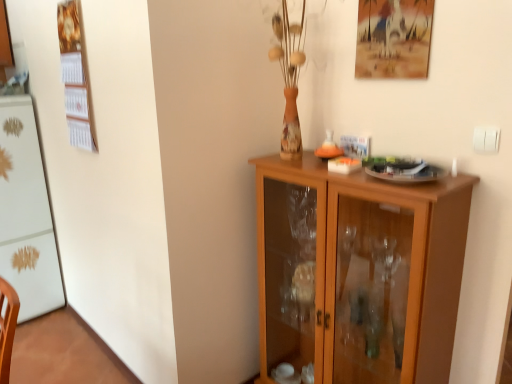
The width and height of the screenshot is (512, 384). Describe the element at coordinates (393, 38) in the screenshot. I see `matte wooden picture frame at upper right` at that location.

Find the location of `wooden cabinet at center`. wooden cabinet at center is located at coordinates (358, 272).

From the image's perspective, relative to wooden cabinet at center, is white glossy refrigerator at left above or below?

Based on their image positions, white glossy refrigerator at left is located above wooden cabinet at center.

Considering the sizes of objects white glossy refrigerator at left and wooden cabinet at center in the image provided, who is thinner, white glossy refrigerator at left or wooden cabinet at center?

Thinner between the two is wooden cabinet at center.

Looking at this image, considering the relative positions of white glossy refrigerator at left and wooden cabinet at center in the image provided, is white glossy refrigerator at left in front of wooden cabinet at center?

No, white glossy refrigerator at left is behind wooden cabinet at center.

Is white glossy refrigerator at left placed right next to wooden cabinet at center?

They are not placed beside each other.

Is matte wooden picture frame at upper right not close to wooden cabinet at center?

No, there isn't a large distance between matte wooden picture frame at upper right and wooden cabinet at center.

From the image's perspective, is matte wooden picture frame at upper right under wooden cabinet at center?

No.

How far apart are matte wooden picture frame at upper right and wooden cabinet at center?

A distance of 29.74 inches exists between matte wooden picture frame at upper right and wooden cabinet at center.

Is wooden cabinet at center at the back of matte wooden picture frame at upper right?

That's not correct — matte wooden picture frame at upper right is not looking away from wooden cabinet at center.

Is wooden cabinet at center placed right next to white glossy refrigerator at left?

They are not placed beside each other.

Consider the image. From a real-world perspective, which is physically below, wooden cabinet at center or white glossy refrigerator at left?

wooden cabinet at center.

At what (x,y) coordinates should I click in order to perform the action: click on appliance above the wooden cabinet at center (from the image's perspective). Please return your answer as a coordinate pair (x, y). The height and width of the screenshot is (384, 512). Looking at the image, I should click on (26, 213).

From the image's perspective, which one is positioned higher, wooden cabinet at center or white glossy refrigerator at left?

white glossy refrigerator at left.

From the image's perspective, which is above, white glossy refrigerator at left or matte wooden picture frame at upper right?

matte wooden picture frame at upper right.

Is white glossy refrigerator at left behind matte wooden picture frame at upper right?

Yes.

Consider the image. How much distance is there between white glossy refrigerator at left and matte wooden picture frame at upper right?

white glossy refrigerator at left is 7.24 feet away from matte wooden picture frame at upper right.

Image resolution: width=512 pixels, height=384 pixels. I want to click on appliance behind the matte wooden picture frame at upper right, so [26, 213].

In the image, is wooden cabinet at center on the left side or the right side of matte wooden picture frame at upper right?

wooden cabinet at center is positioned on matte wooden picture frame at upper right's left side.

Which of these two, wooden cabinet at center or matte wooden picture frame at upper right, is smaller?

matte wooden picture frame at upper right.

Is wooden cabinet at center facing towards matte wooden picture frame at upper right?

No.

Considering the points (380, 33) and (20, 173), which point is in front, point (380, 33) or point (20, 173)?

Positioned in front is point (380, 33).

Is matte wooden picture frame at upper right far from white glossy refrigerator at left?

matte wooden picture frame at upper right is far away from white glossy refrigerator at left.

From the image's perspective, is matte wooden picture frame at upper right above or below white glossy refrigerator at left?

Based on their image positions, matte wooden picture frame at upper right is located above white glossy refrigerator at left.

Can you confirm if matte wooden picture frame at upper right is shorter than white glossy refrigerator at left?

Yes, matte wooden picture frame at upper right is shorter than white glossy refrigerator at left.

Locate an element on the screen. This screenshot has width=512, height=384. cupboard located on the right of white glossy refrigerator at left is located at coordinates (358, 272).

At what (x,y) coordinates should I click in order to perform the action: click on cupboard below the matte wooden picture frame at upper right (from the image's perspective). Please return your answer as a coordinate pair (x, y). This screenshot has height=384, width=512. Looking at the image, I should click on coord(358,272).

Estimate the real-world distances between objects in this image. Which object is closer to wooden cabinet at center, white glossy refrigerator at left or matte wooden picture frame at upper right?

matte wooden picture frame at upper right.

From the image, which object appears to be nearer to matte wooden picture frame at upper right, white glossy refrigerator at left or wooden cabinet at center?

wooden cabinet at center lies closer to matte wooden picture frame at upper right than the other object.

From the image, which object appears to be nearer to wooden cabinet at center, matte wooden picture frame at upper right or white glossy refrigerator at left?

Based on the image, matte wooden picture frame at upper right appears to be nearer to wooden cabinet at center.

Consider the image. From the image, which object appears to be nearer to matte wooden picture frame at upper right, wooden cabinet at center or white glossy refrigerator at left?

Based on the image, wooden cabinet at center appears to be nearer to matte wooden picture frame at upper right.

Estimate the real-world distances between objects in this image. Which object is further from white glossy refrigerator at left, wooden cabinet at center or matte wooden picture frame at upper right?

A: Based on the image, matte wooden picture frame at upper right appears to be further to white glossy refrigerator at left.

Based on their spatial positions, is matte wooden picture frame at upper right or wooden cabinet at center closer to white glossy refrigerator at left?

Based on the image, wooden cabinet at center appears to be nearer to white glossy refrigerator at left.

Locate an element on the screen. The width and height of the screenshot is (512, 384). cupboard between white glossy refrigerator at left and matte wooden picture frame at upper right from left to right is located at coordinates (358, 272).